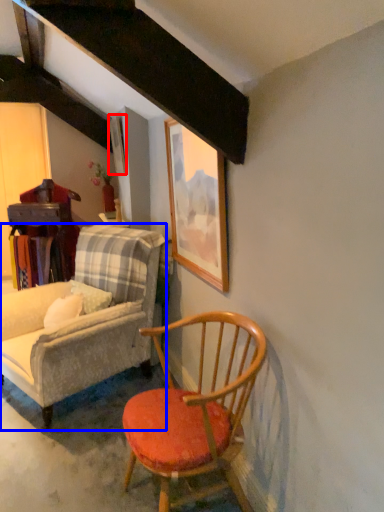
Question: Which point is further to the camera, picture frame (highlighted by a red box) or chair (highlighted by a blue box)?

Choices:
 (A) picture frame
 (B) chair

Answer: (A)